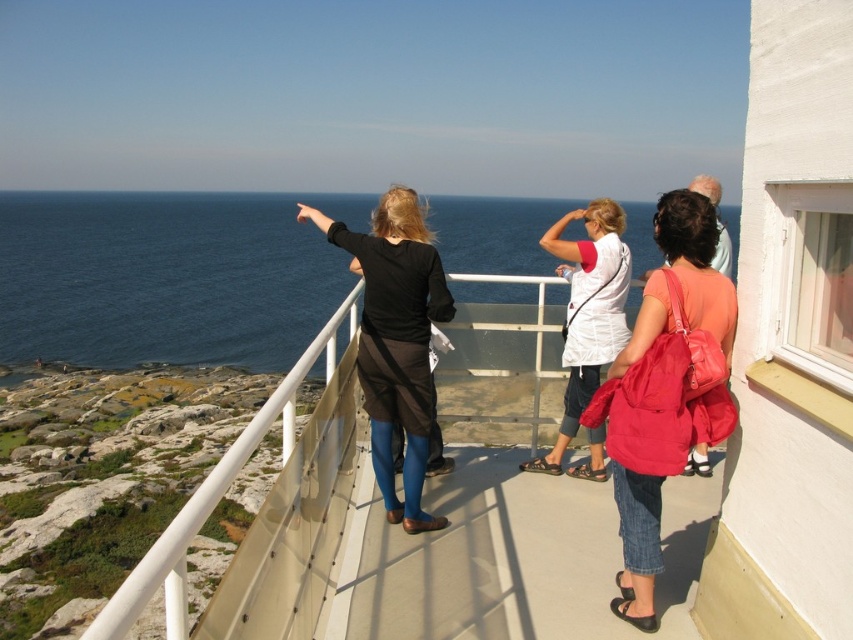
You are standing on the balcony and looking out. You notice the blue water at upper left and the denim jacket at lower right. Which object takes up more space in your view?

The blue water at upper left takes up more space in your view because it has a larger size compared to the denim jacket at lower right.

You are standing on the balcony and want to move from the point at coordinates point (630,493) to the point at coordinates point (566,444). Considering the balcony layout described, can you walk directly from the first point to the second without any obstacles?

Point (630,493) is in front of point (566,444), so you can walk directly from point (630,493) to point (566,444) without any obstacles between them.